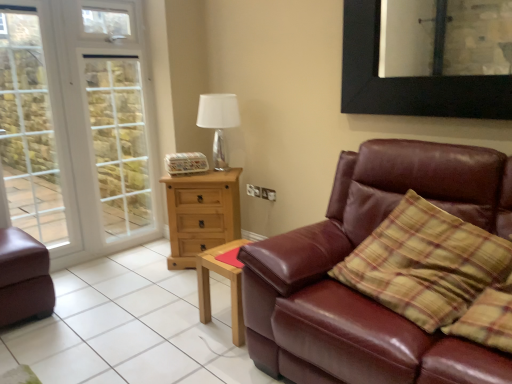
The height and width of the screenshot is (384, 512). I want to click on empty space that is ontop of light brown wooden chest of drawers at center (from a real-world perspective), so click(203, 171).